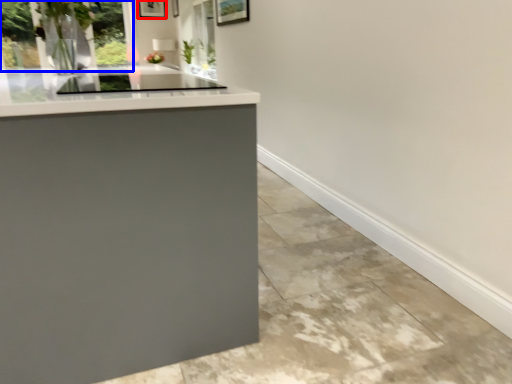
Question: Which of the following is the farthest to the observer, picture frame (highlighted by a red box) or window (highlighted by a blue box)?

Choices:
 (A) picture frame
 (B) window

Answer: (A)